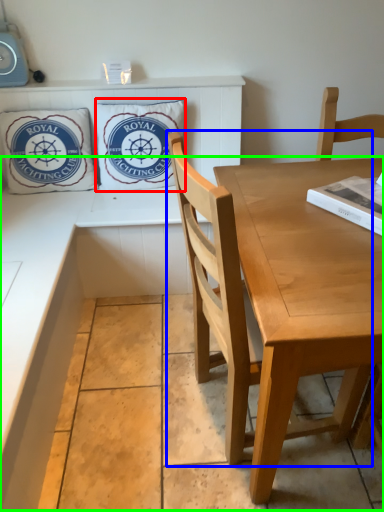
Question: Estimate the real-world distances between objects in this image. Which object is closer to pillow (highlighted by a red box), chair (highlighted by a blue box) or counter (highlighted by a green box)?

Choices:
 (A) chair
 (B) counter

Answer: (B)